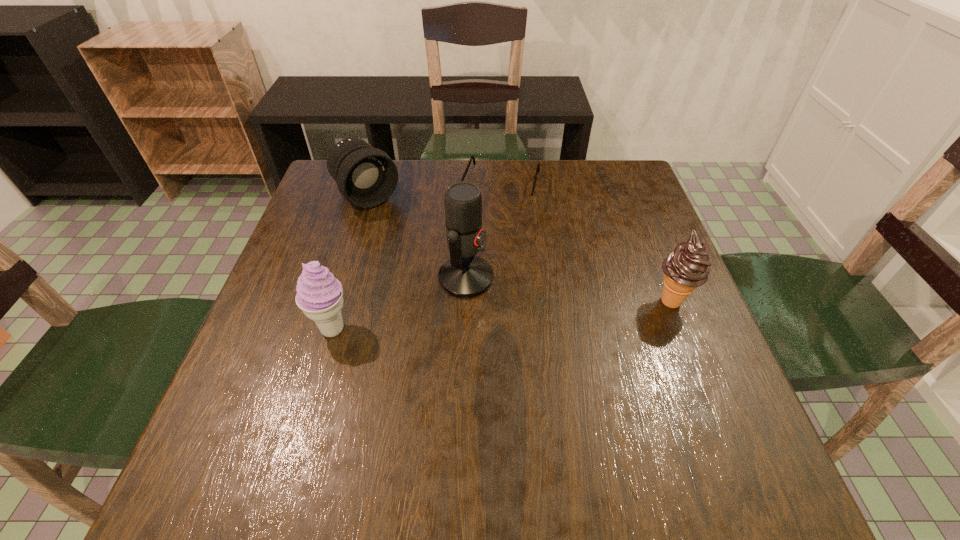
What are the coordinates of `vacant space on the desktop that is between the left icecream and the right icecream and is positioned at the front element of the telephoto lens` in the screenshot? It's located at (481, 316).

You are a GUI agent. You are given a task and a screenshot of the screen. Output one action in this format:
    pyautogui.click(x=<x>, y=<y>)
    Task: Click on the vacant space on the desktop that is between the left icecream and the right icecream and is positioned on the side of the tallest object with the red ring
    This screenshot has width=960, height=540.
    Given the screenshot: What is the action you would take?
    pyautogui.click(x=554, y=310)

This screenshot has width=960, height=540. I want to click on free space on the desktop that is between the left icecream and the rightmost object and is positioned at the hinge ends of the shortest object, so click(461, 318).